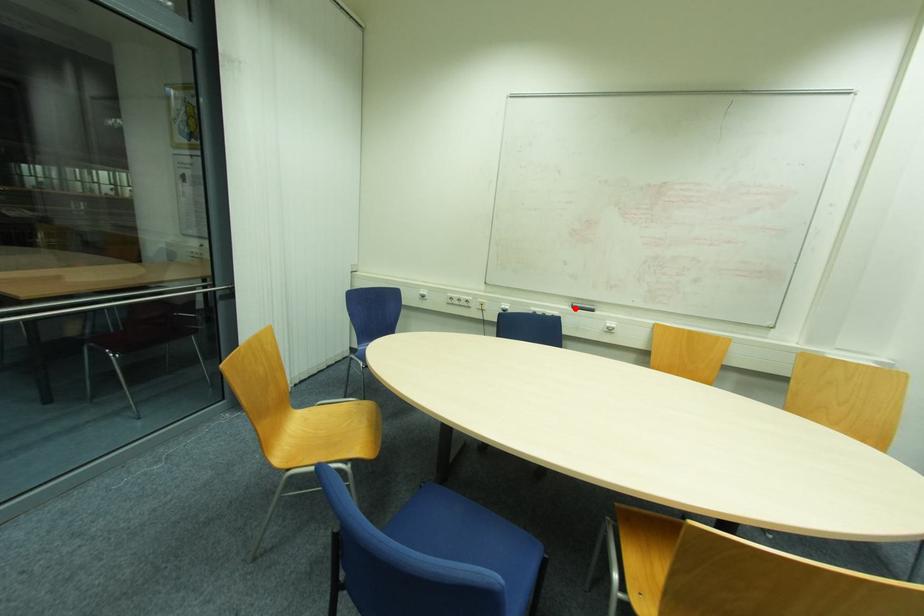
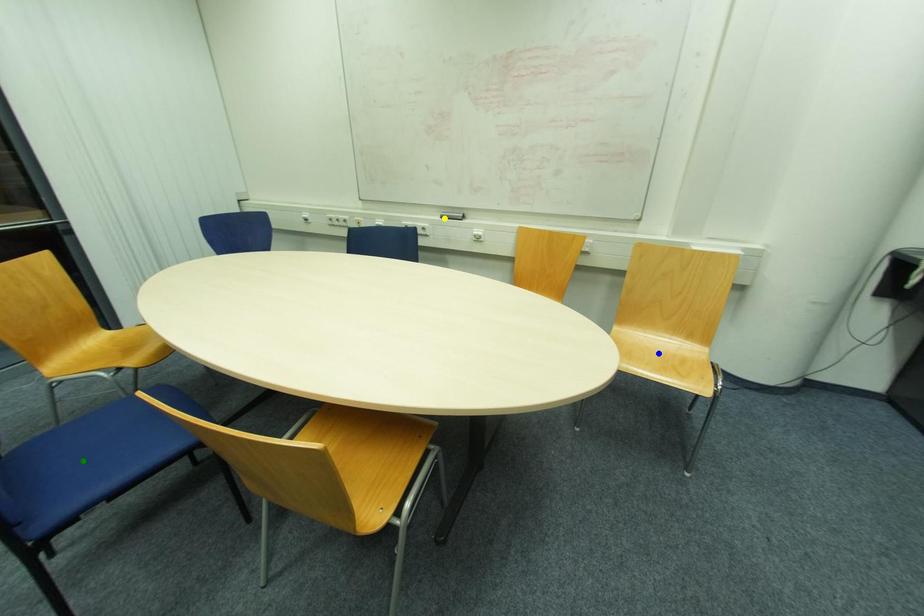
Question: I am providing you with two images of the same scene from different viewpoints. A red point is marked on the first image. You are given multiple points on the second image. In image 2, which mark is for the same physical point as the one in image 1?

Choices:
 (A) blue point
 (B) yellow point
 (C) green point

Answer: (B)